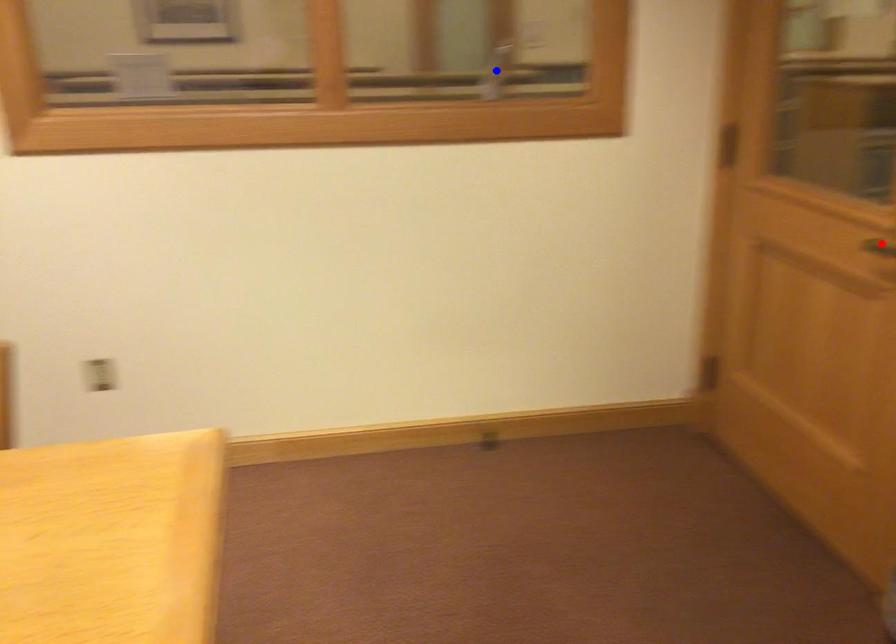
Question: Two points are marked on the image. Which point is closer to the camera?

Choices:
 (A) Blue point is closer.
 (B) Red point is closer.

Answer: (B)